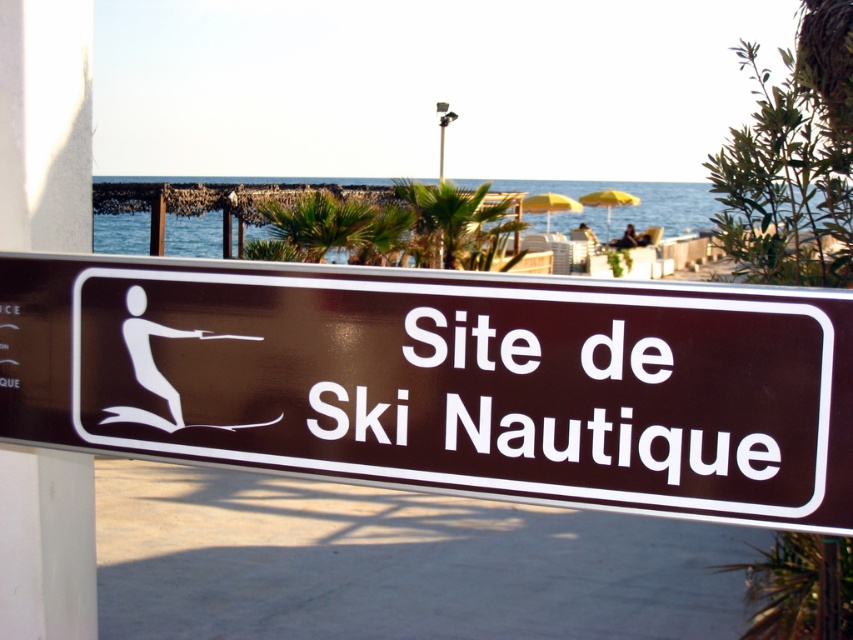
Question: Does brown glossy sign at center have a smaller size compared to green leafy palm tree at center?

Choices:
 (A) no
 (B) yes

Answer: (B)

Question: Which of the following is the farthest from the observer?

Choices:
 (A) [x=409, y=196]
 (B) [x=408, y=388]

Answer: (A)

Question: Is white plastic text at center below green leafy palm tree at center?

Choices:
 (A) no
 (B) yes

Answer: (B)

Question: Among these objects, which one is farthest from the camera?

Choices:
 (A) brown glossy sign at center
 (B) green leafy palm tree at center
 (C) white plastic sign at center

Answer: (B)

Question: Which point is closer to the camera?

Choices:
 (A) white plastic text at center
 (B) brown glossy sign at center

Answer: (B)

Question: Is brown glossy sign at center bigger than white plastic text at center?

Choices:
 (A) yes
 (B) no

Answer: (A)